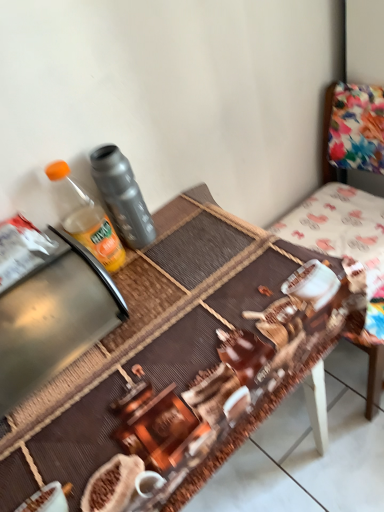
This screenshot has width=384, height=512. What are the coordinates of `empty space that is ontop of brown woven mat at center (from a real-world perspective)` in the screenshot? It's located at (144, 329).